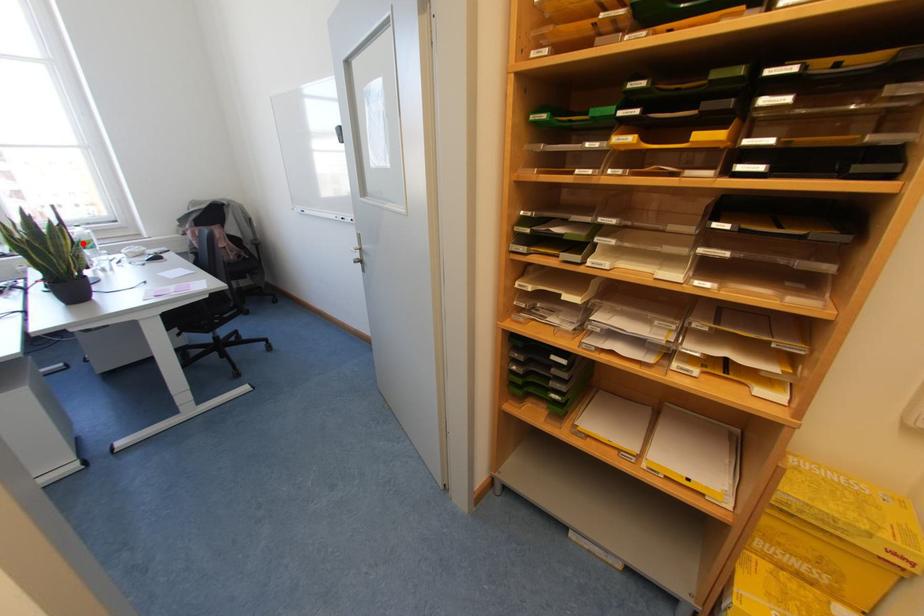
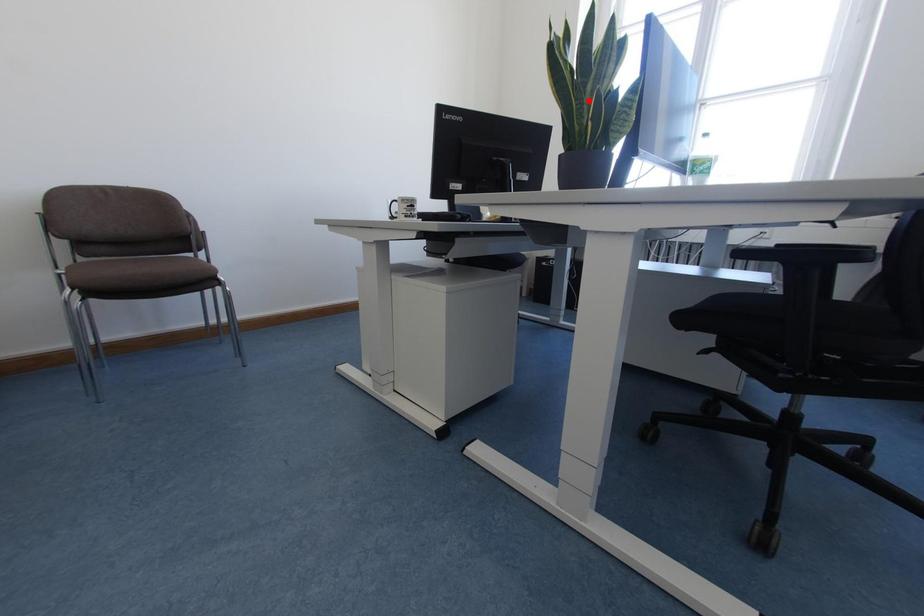
I am providing you with two images of the same scene from different viewpoints. A red point is marked on the first image and another point is marked on the second image. Are the points marked in image1 and image2 representing the same 3D position?

No